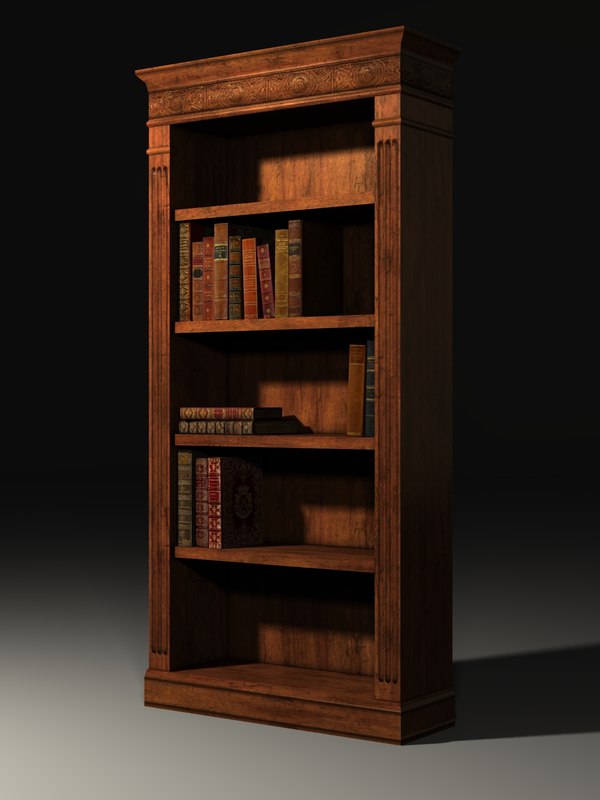
The image size is (600, 800). Find the location of `shelf`. shelf is located at coordinates (288, 562), (282, 445), (304, 324), (301, 206).